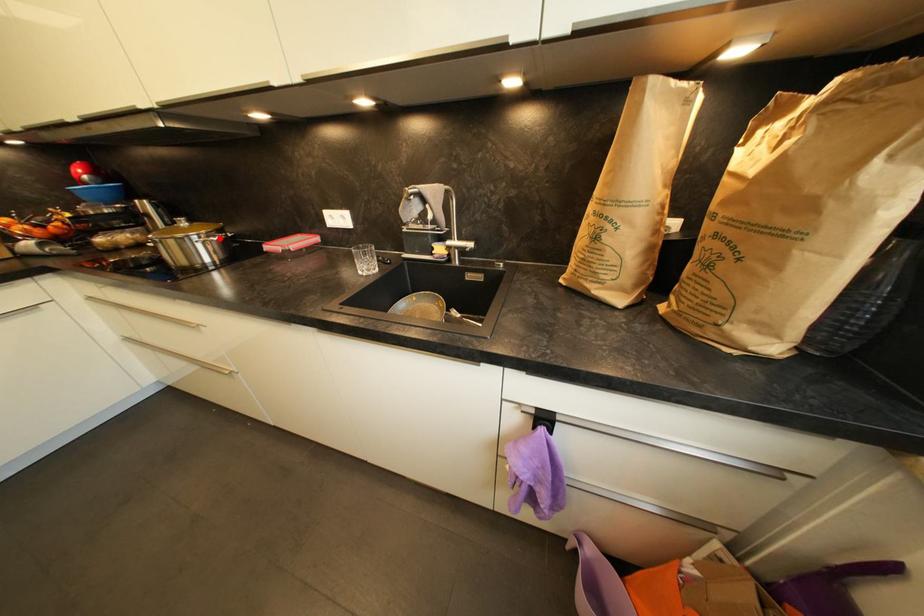
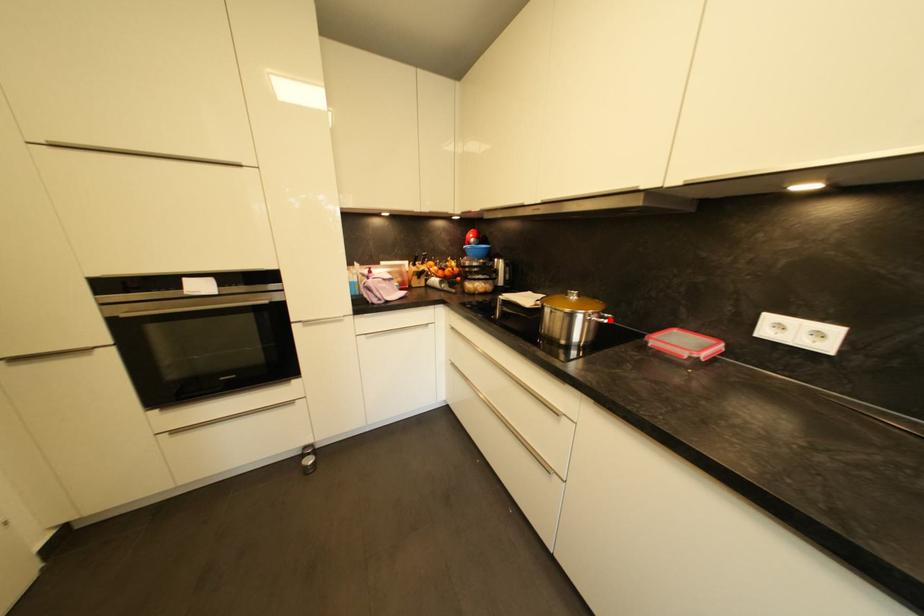
I am providing you with two images of the same scene from different viewpoints. A red point is marked on the first image and another point is marked on the second image. Do the highlighted points in image1 and image2 indicate the same real-world spot?

Yes